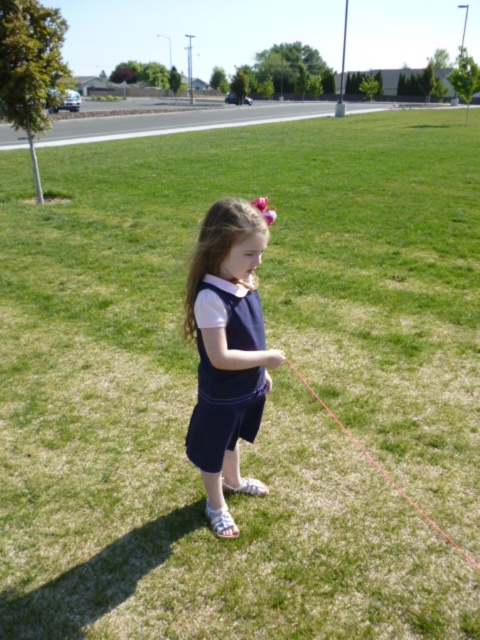
The young girl is holding something in her hands. Which object is positioned to the right when you look at the matte navy dress at center and the red string at lower center?

The red string at lower center is to the right of the matte navy dress at center.

You are taking a photo of the girl holding the red string. You want to focus on the point closer to you. Which point should you choose between point [238,476] and point [213,449]?

Point [213,449] is closer to you, so you should choose point [213,449] to focus on.